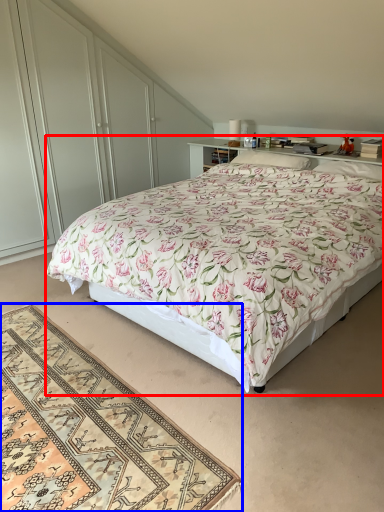
Question: Which object appears farthest to the camera in this image, bed (highlighted by a red box) or mat (highlighted by a blue box)?

Choices:
 (A) bed
 (B) mat

Answer: (A)